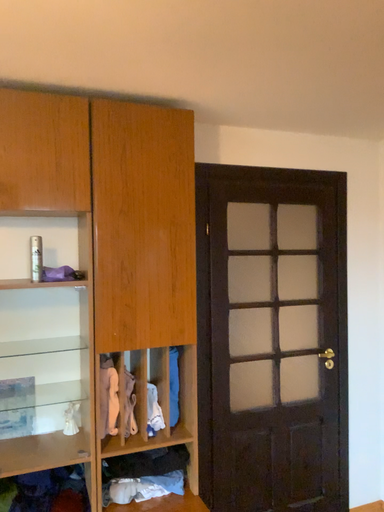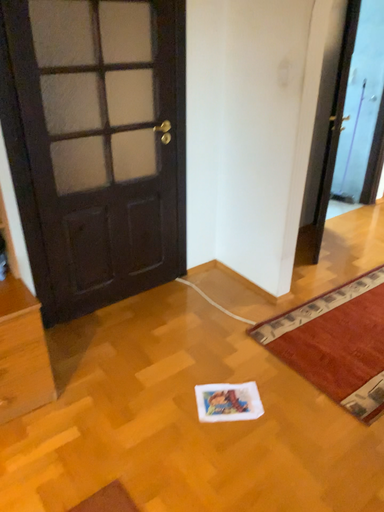
Question: How did the camera likely rotate when shooting the video?

Choices:
 (A) rotated right
 (B) rotated left

Answer: (A)